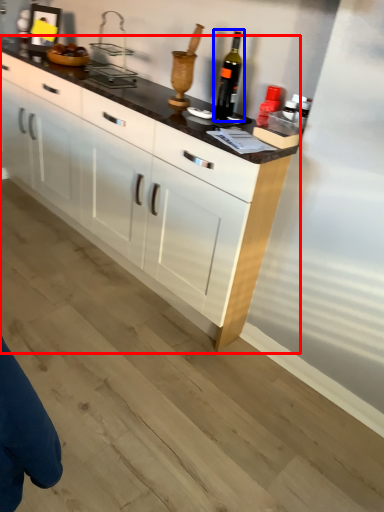
Question: Which point is closer to the camera, cabinetry (highlighted by a red box) or wine bottle (highlighted by a blue box)?

Choices:
 (A) cabinetry
 (B) wine bottle

Answer: (A)